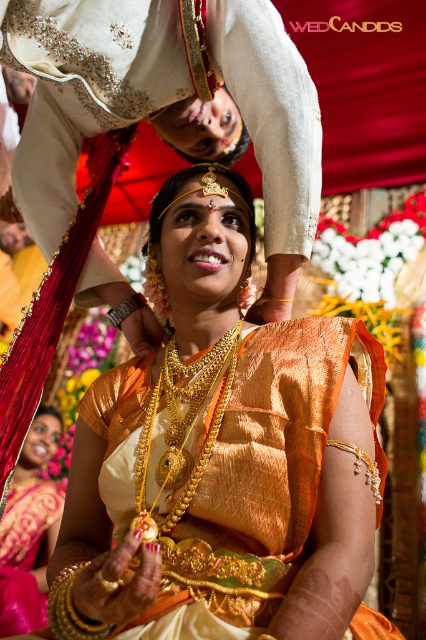
You are a photographer at the wedding and want to capture a closeup of the necklaces. Which necklace, the golden ornate necklace at center or the matte gold necklace at center, appears larger in the photo?

The golden ornate necklace at center appears larger in the photo because it is closer to the viewer than the matte gold necklace at center.